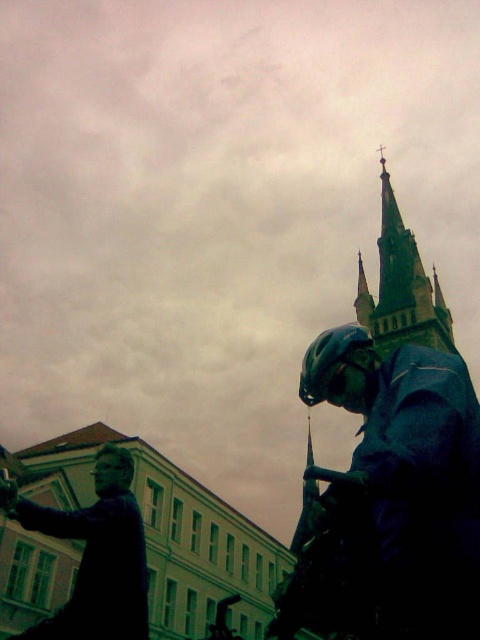
You are standing in front of the statue and want to take a photo that includes both the shiny dark blue helmet at center and the stone steeple at upper center. Which object should you position closer to the front of your camera frame to ensure both are in focus?

You should position the shiny dark blue helmet at center closer to the front of your camera frame because it is closer to the viewer than the stone steeple at upper center, ensuring both are in focus.

You are standing in the square and want to take a photo of both the matte black statue at lower left and the stone steeple at upper center in the same frame. Which object should you position closer to the camera to ensure both are fully visible?

You should position the matte black statue at lower left closer to the camera because it is shorter than the stone steeple at upper center, so keeping it nearer will help include both in the frame without cropping either.

You are a tourist standing in front of the statue and want to take a photo that includes both the shiny dark blue helmet at center and the stone steeple at upper center. Based on their positions, which object should appear to the left in your photo?

The shiny dark blue helmet at center is positioned on the left side of the stone steeple at upper center, so in the photo, the shiny dark blue helmet at center will appear to the left of the stone steeple at upper center.